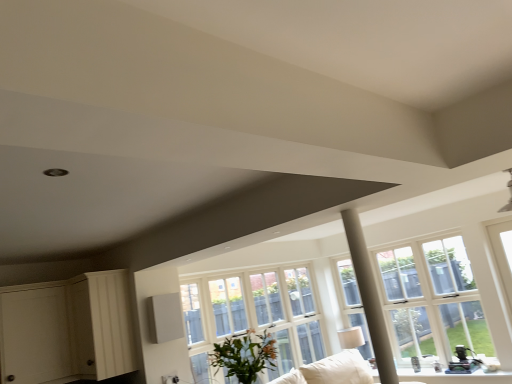
Question: From the image's perspective, would you say green leafy plant at center is shown under clear glass window at center?

Choices:
 (A) yes
 (B) no

Answer: (B)

Question: Considering the relative sizes of green leafy plant at center and clear glass window at center in the image provided, is green leafy plant at center thinner than clear glass window at center?

Choices:
 (A) yes
 (B) no

Answer: (B)

Question: From a real-world perspective, is green leafy plant at center on clear glass window at center?

Choices:
 (A) no
 (B) yes

Answer: (A)

Question: Does green leafy plant at center have a smaller size compared to clear glass window at center?

Choices:
 (A) yes
 (B) no

Answer: (A)

Question: Considering the relative positions of green leafy plant at center and clear glass window at center in the image provided, is green leafy plant at center to the left of clear glass window at center from the viewer's perspective?

Choices:
 (A) yes
 (B) no

Answer: (A)

Question: Is green leafy plant at center facing towards clear glass window at center?

Choices:
 (A) no
 (B) yes

Answer: (A)

Question: Can you confirm if clear glass window at center is wider than white wood dresser at lower left?

Choices:
 (A) yes
 (B) no

Answer: (B)

Question: Considering the relative sizes of clear glass window at center and white wood dresser at lower left in the image provided, is clear glass window at center taller than white wood dresser at lower left?

Choices:
 (A) yes
 (B) no

Answer: (A)

Question: Is clear glass window at center with white wood dresser at lower left?

Choices:
 (A) yes
 (B) no

Answer: (B)

Question: Considering the relative sizes of clear glass window at center and white wood dresser at lower left in the image provided, is clear glass window at center thinner than white wood dresser at lower left?

Choices:
 (A) no
 (B) yes

Answer: (B)

Question: Is clear glass window at center turned away from white wood dresser at lower left?

Choices:
 (A) yes
 (B) no

Answer: (B)

Question: Does clear glass window at center appear on the right side of white wood dresser at lower left?

Choices:
 (A) no
 (B) yes

Answer: (B)

Question: Does clear glass window at center appear on the left side of white fabric couch at lower center?

Choices:
 (A) yes
 (B) no

Answer: (B)